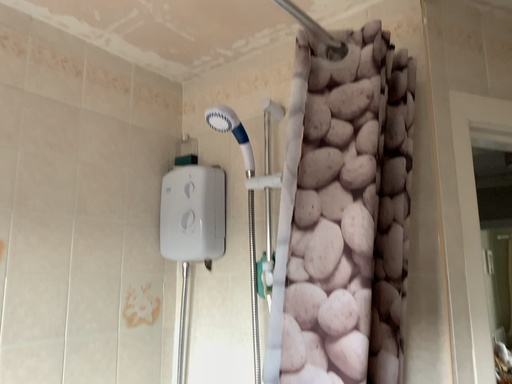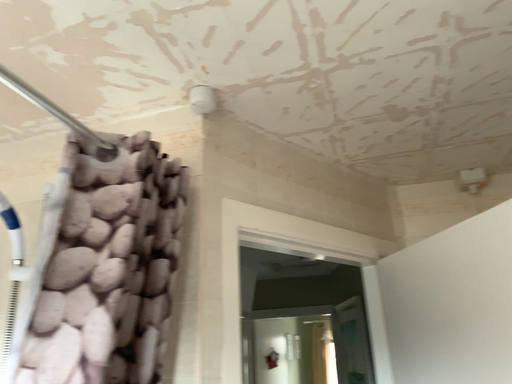
Question: How did the camera likely rotate when shooting the video?

Choices:
 (A) rotated right
 (B) rotated left

Answer: (A)